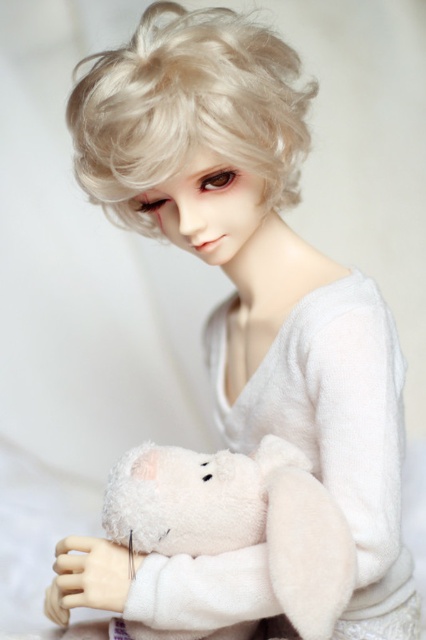
Question: Does blonde curly wig at upper center lie behind white plush bear at center?

Choices:
 (A) yes
 (B) no

Answer: (A)

Question: Does white fluffy robe at center have a larger size compared to white plush bear at center?

Choices:
 (A) yes
 (B) no

Answer: (A)

Question: Considering the real-world distances, which object is farthest from the blonde curly wig at upper center?

Choices:
 (A) white plush bear at center
 (B) white fluffy robe at center

Answer: (A)

Question: Considering the real-world distances, which object is farthest from the blonde curly wig at upper center?

Choices:
 (A) white fluffy robe at center
 (B) white plush bear at center

Answer: (B)

Question: Which object is closer to the camera taking this photo?

Choices:
 (A) white fluffy robe at center
 (B) blonde curly wig at upper center
 (C) white plush bear at center

Answer: (C)

Question: Does blonde curly wig at upper center have a smaller size compared to white plush bear at center?

Choices:
 (A) yes
 (B) no

Answer: (B)